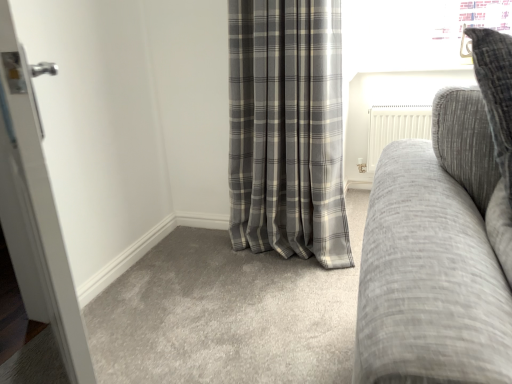
Question: Is gray plaid curtain at center smaller than white glossy door at left?

Choices:
 (A) yes
 (B) no

Answer: (B)

Question: Is gray plaid curtain at center oriented towards white glossy door at left?

Choices:
 (A) yes
 (B) no

Answer: (A)

Question: From the image's perspective, is gray plaid curtain at center below white glossy door at left?

Choices:
 (A) no
 (B) yes

Answer: (A)

Question: From a real-world perspective, is gray plaid curtain at center positioned over white glossy door at left based on gravity?

Choices:
 (A) no
 (B) yes

Answer: (B)

Question: Is gray plaid curtain at center oriented away from white glossy door at left?

Choices:
 (A) yes
 (B) no

Answer: (B)

Question: Considering the relative sizes of gray plaid curtain at center and white glossy door at left in the image provided, is gray plaid curtain at center taller than white glossy door at left?

Choices:
 (A) no
 (B) yes

Answer: (B)

Question: Is the depth of textured gray couch at right less than that of white glossy door at left?

Choices:
 (A) no
 (B) yes

Answer: (B)

Question: Considering the relative sizes of textured gray couch at right and white glossy door at left in the image provided, is textured gray couch at right thinner than white glossy door at left?

Choices:
 (A) yes
 (B) no

Answer: (B)

Question: Does textured gray couch at right have a larger size compared to white glossy door at left?

Choices:
 (A) yes
 (B) no

Answer: (A)

Question: Are textured gray couch at right and white glossy door at left making contact?

Choices:
 (A) yes
 (B) no

Answer: (B)

Question: From a real-world perspective, is textured gray couch at right on white glossy door at left?

Choices:
 (A) yes
 (B) no

Answer: (A)

Question: Is there a large distance between textured gray couch at right and white glossy door at left?

Choices:
 (A) yes
 (B) no

Answer: (B)

Question: From the image's perspective, is gray plaid curtain at center beneath textured gray couch at right?

Choices:
 (A) yes
 (B) no

Answer: (B)